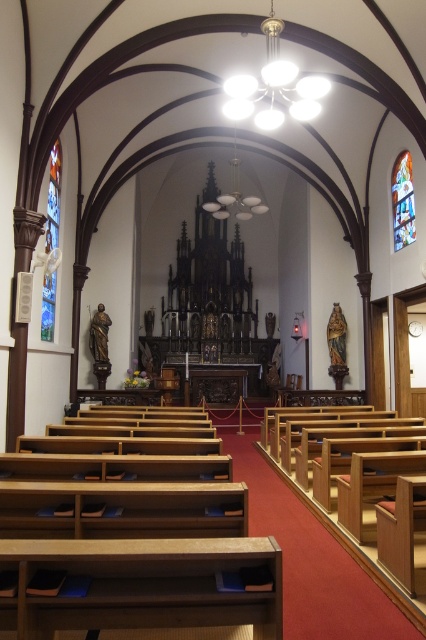
Between stained glass window at left and stained glass at upper right, which one has less height?

Standing shorter between the two is stained glass at upper right.

Does stained glass window at left appear over stained glass at upper right?

No, stained glass window at left is not above stained glass at upper right.

Locate an element on the screen. This screenshot has height=640, width=426. stained glass window at left is located at coordinates (54, 196).